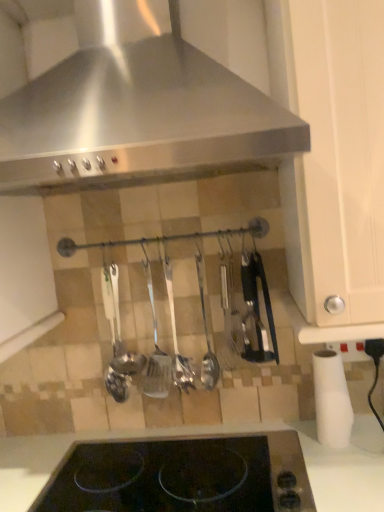
In order to click on satin silver spoon at center in this screenshot , I will do `click(121, 339)`.

In order to face satin silver spoon at center, should I rotate leftwards or rightwards?

You should rotate left by 8.647 degrees.

At what (x,y) coordinates should I click in order to perform the action: click on white matte cabinet at right. Please return your answer as a coordinate pair (x, y). Looking at the image, I should click on (334, 154).

What do you see at coordinates (181, 476) in the screenshot? I see `black glass at center` at bounding box center [181, 476].

What are the coordinates of `white matte paper towel at lower right` in the screenshot? It's located at (331, 400).

Locate an element on the screen. This screenshot has width=384, height=512. polished metal ladle at center, positioned as the third silverware in right-to-left order is located at coordinates (156, 353).

Which is farther from the camera, (205, 361) or (335, 432)?

The point (205, 361) is more distant.

Is polished metal ladle at center, the third silverware when ordered from left to right, far from white matte paper towel at lower right?

No, polished metal ladle at center, the third silverware when ordered from left to right, is not far from white matte paper towel at lower right.

Consider the image. Is polished metal ladle at center, the third silverware when ordered from left to right, not within white matte paper towel at lower right?

polished metal ladle at center, the third silverware when ordered from left to right, is positioned outside white matte paper towel at lower right.

From a real-world perspective, is polished metal ladle at center, arranged as the 1th silverware when viewed from the right, on white matte paper towel at lower right?

Yes, from a real-world perspective, polished metal ladle at center, arranged as the 1th silverware when viewed from the right, is on top of white matte paper towel at lower right.

Measure the distance from black glass at center to satin silver spoon at center.

A distance of 12.14 inches exists between black glass at center and satin silver spoon at center.

Considering the positions of objects black glass at center and satin silver spoon at center in the image provided, who is more to the left, black glass at center or satin silver spoon at center?

Positioned to the left is satin silver spoon at center.

Between black glass at center and satin silver spoon at center, which one has smaller width?

With smaller width is satin silver spoon at center.

Image resolution: width=384 pixels, height=512 pixels. I want to click on gas stove that appears on the right of satin silver spoon at center, so click(x=181, y=476).

Does black glass at center contain white matte cabinet at right?

Actually, white matte cabinet at right is outside black glass at center.

Considering the relative sizes of black glass at center and white matte cabinet at right in the image provided, is black glass at center bigger than white matte cabinet at right?

Actually, black glass at center might be smaller than white matte cabinet at right.

In the image, is black glass at center positioned in front of or behind white matte cabinet at right?

black glass at center is behind white matte cabinet at right.

In terms of width, does polished metal ladle at center, which is counted as the first silverware, starting from the left, look wider or thinner when compared to white matte paper towel at lower right?

polished metal ladle at center, which is counted as the first silverware, starting from the left, is thinner than white matte paper towel at lower right.

Who is smaller, polished metal ladle at center, which is counted as the first silverware, starting from the left, or white matte paper towel at lower right?

polished metal ladle at center, which is counted as the first silverware, starting from the left.

From the image's perspective, is polished metal ladle at center, which is counted as the first silverware, starting from the left, over white matte paper towel at lower right?

Yes, from the image's perspective, polished metal ladle at center, which is counted as the first silverware, starting from the left, is over white matte paper towel at lower right.

What's the angular difference between white matte cabinet at right and polished metal ladle at center, which is the second silverware in left-to-right order,'s facing directions?

0.297 degrees separate the facing orientations of white matte cabinet at right and polished metal ladle at center, which is the second silverware in left-to-right order.

Is white matte cabinet at right facing away from polished metal ladle at center, marked as the 2th silverware in a right-to-left arrangement?

white matte cabinet at right is not turned away from polished metal ladle at center, marked as the 2th silverware in a right-to-left arrangement.

Which of these two, white matte cabinet at right or polished metal ladle at center, marked as the 2th silverware in a right-to-left arrangement, is bigger?

white matte cabinet at right.

Where is `silverware that is the 2nd one when counting backward from the white matte cabinet at right`? silverware that is the 2nd one when counting backward from the white matte cabinet at right is located at coordinates (176, 332).

Which of these two, white matte paper towel at lower right or stainless steel range hood at upper center, is wider?

stainless steel range hood at upper center.

Identify the location of paper towel below the stainless steel range hood at upper center (from a real-world perspective). This screenshot has width=384, height=512. (331, 400).

Is point (320, 439) closer or farther from the camera than point (96, 69)?

Point (320, 439).

From the image's perspective, which is below, white matte paper towel at lower right or stainless steel range hood at upper center?

white matte paper towel at lower right appears lower in the image.

Which of these two, white matte paper towel at lower right or black glass at center, is thinner?

white matte paper towel at lower right is thinner.

Considering the relative sizes of white matte paper towel at lower right and black glass at center in the image provided, is white matte paper towel at lower right shorter than black glass at center?

Incorrect, the height of white matte paper towel at lower right does not fall short of that of black glass at center.

Considering the relative sizes of white matte paper towel at lower right and black glass at center in the image provided, is white matte paper towel at lower right bigger than black glass at center?

Incorrect, white matte paper towel at lower right is not larger than black glass at center.

In order to click on paper towel that appears above the black glass at center (from the image's perspective) in this screenshot , I will do `click(331, 400)`.

This screenshot has height=512, width=384. I want to click on the 1st silverware located above the white matte paper towel at lower right (from a real-world perspective), so click(x=206, y=339).

Image resolution: width=384 pixels, height=512 pixels. Identify the location of gas stove below the satin silver spoon at center (from the image's perspective). (181, 476).

Considering their positions, is polished metal ladle at center, which is the second silverware in left-to-right order, positioned closer to satin silver spoon at center than white matte cabinet at right?

polished metal ladle at center, which is the second silverware in left-to-right order, is positioned closer to the anchor satin silver spoon at center.

From the image, which object appears to be nearer to satin silver spoon at center, white matte paper towel at lower right or polished metal ladle at center, the third silverware when ordered from left to right?

polished metal ladle at center, the third silverware when ordered from left to right, lies closer to satin silver spoon at center than the other object.

From the image, which object appears to be farther from stainless steel range hood at upper center, polished metal ladle at center, positioned as the third silverware in right-to-left order, or white matte paper towel at lower right?

white matte paper towel at lower right is further to stainless steel range hood at upper center.

From the image, which object appears to be nearer to satin silver spoon at center, polished metal ladle at center, marked as the 2th silverware in a right-to-left arrangement, or stainless steel range hood at upper center?

Among the two, polished metal ladle at center, marked as the 2th silverware in a right-to-left arrangement, is located nearer to satin silver spoon at center.

From the image, which object appears to be farther from polished metal ladle at center, the third silverware when ordered from left to right, white matte paper towel at lower right or stainless steel range hood at upper center?

Based on the image, stainless steel range hood at upper center appears to be further to polished metal ladle at center, the third silverware when ordered from left to right.

From the image, which object appears to be farther from satin silver spoon at center, stainless steel range hood at upper center or polished metal ladle at center, positioned as the third silverware in right-to-left order?

stainless steel range hood at upper center is positioned further to the anchor satin silver spoon at center.

From the picture: Based on their spatial positions, is polished metal ladle at center, which is counted as the first silverware, starting from the left, or stainless steel range hood at upper center further from satin silver spoon at center?

Based on the image, stainless steel range hood at upper center appears to be further to satin silver spoon at center.

Based on the photo, estimate the real-world distances between objects in this image. Which object is closer to polished metal ladle at center, positioned as the third silverware in right-to-left order, black glass at center or stainless steel range hood at upper center?

The object closer to polished metal ladle at center, positioned as the third silverware in right-to-left order, is black glass at center.

The height and width of the screenshot is (512, 384). I want to click on silverware that lies between stainless steel range hood at upper center and polished metal ladle at center, which is the second silverware in left-to-right order, from top to bottom, so click(206, 339).

Identify the location of gas stove between polished metal ladle at center, which is counted as the first silverware, starting from the left, and white matte paper towel at lower right from left to right. (181, 476).

Where is `gas stove between polished metal ladle at center, marked as the 2th silverware in a right-to-left arrangement, and white matte paper towel at lower right, in the horizontal direction`? gas stove between polished metal ladle at center, marked as the 2th silverware in a right-to-left arrangement, and white matte paper towel at lower right, in the horizontal direction is located at coordinates (181, 476).

Where is `silverware between white matte cabinet at right and polished metal ladle at center, which is the second silverware in left-to-right order, along the z-axis`? This screenshot has width=384, height=512. silverware between white matte cabinet at right and polished metal ladle at center, which is the second silverware in left-to-right order, along the z-axis is located at coordinates (206, 339).